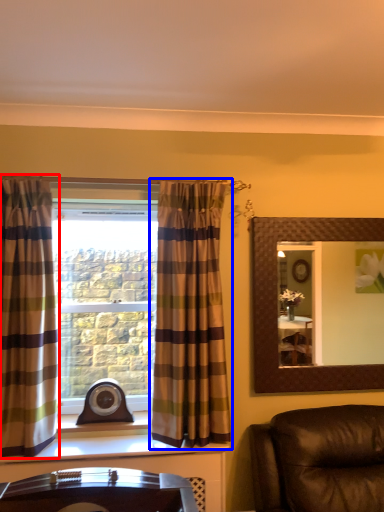
Question: Which object appears farthest to the camera in this image, curtain (highlighted by a red box) or curtain (highlighted by a blue box)?

Choices:
 (A) curtain
 (B) curtain

Answer: (B)